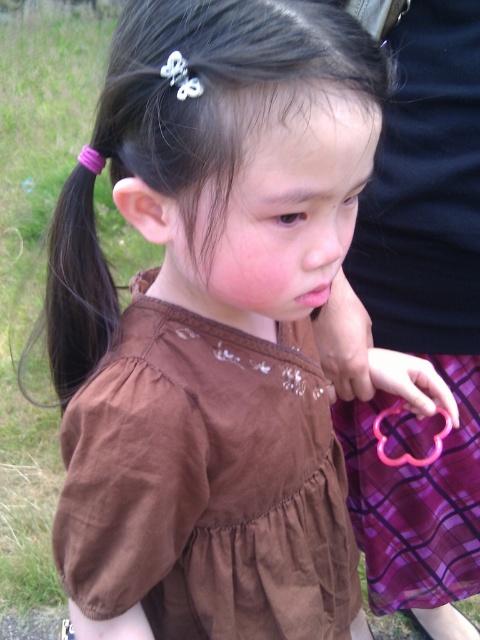
You are a photographer trying to capture the girl in the scene. The girl is standing in a grassy area with a blurred figure in dark clothing nearby. You need to focus on the purple elastic hairband at left. Where exactly should you aim your camera to ensure the point at coordinate point (78, 282) is captured?

The point (78, 282) is located on the purple elastic hairband at left, so aim your camera at that specific hairband to capture the coordinate.

You are a photographer trying to capture a candid shot of the girl in the scene. You notice two points marked in the image. The first point is at coordinate point (x=143, y=502) and the second is at point (x=54, y=257). Which point should you focus on to ensure the girl is in sharp focus?

You should focus on point (x=143, y=502) because it is in front of point (x=54, y=257), meaning the girl is closer to the camera at that position, ensuring better focus.

From the picture: The girl is wearing a brown suede dress at center and has a purple elastic hairband at left. Which item is positioned more to the left side of the image?

The purple elastic hairband at left is positioned more to the left side of the image than the brown suede dress at center.